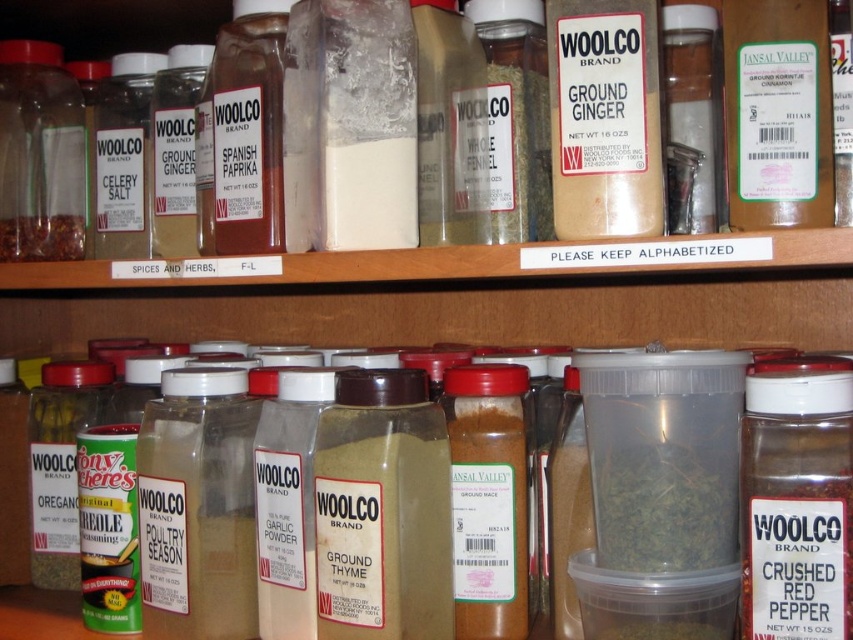
You are organizing a spice rack and need to place the green herb at center and the brown powder spice at left. Which one requires more space due to its size?

The green herb at center requires more space because it is bigger than the brown powder spice at left.

You are standing in front of the spice rack and want to reach for the point at coordinates point (723, 44) and point (44, 99). Which point is closer to you?

Point (723, 44) is in front of point (44, 99), so point (723, 44) is closer to you.

You are organizing the spice rack and need to place a new spice container that requires more space vertically. Which container between the green herb at center and the brown powder spice at left should you place it next to?

The green herb at center is taller than the brown powder spice at left, so you should place the new spice container next to the brown powder spice at left to accommodate its vertical space requirements.